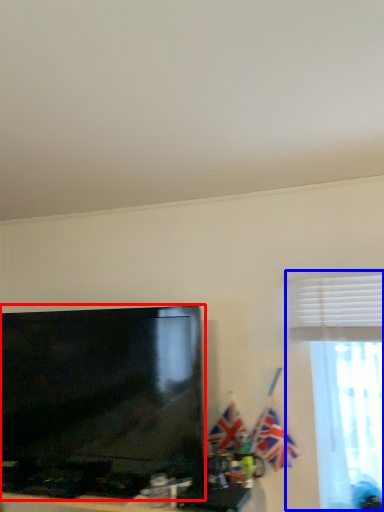
Question: Among these objects, which one is nearest to the camera, television (highlighted by a red box) or window (highlighted by a blue box)?

Choices:
 (A) television
 (B) window

Answer: (A)